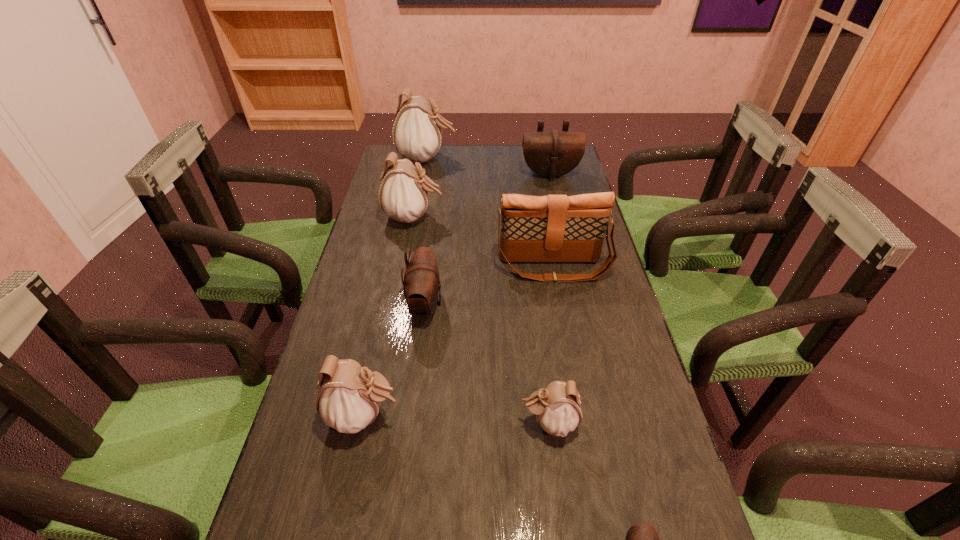
Where is `the farthest white pouch`? This screenshot has height=540, width=960. the farthest white pouch is located at coordinates (417, 131).

Locate an element on the screen. Image resolution: width=960 pixels, height=540 pixels. the tallest pouch is located at coordinates (417, 131).

This screenshot has width=960, height=540. What are the coordinates of `shoulder bag` in the screenshot? It's located at coord(554,228).

You are a GUI agent. You are given a task and a screenshot of the screen. Output one action in this format:
    pyautogui.click(x=<x>, y=<y>)
    Task: Click on the sixth nearest object
    The image size is (960, 540).
    Given the screenshot: What is the action you would take?
    pyautogui.click(x=403, y=196)

Identify the location of the third farthest pouch. (403, 196).

Locate an element on the screen. Image resolution: width=960 pixels, height=540 pixels. the biggest brown pouch is located at coordinates 551,154.

This screenshot has width=960, height=540. I want to click on the third biggest white pouch, so click(x=349, y=396).

Locate an element on the screen. This screenshot has height=540, width=960. the second smallest brown pouch is located at coordinates (421, 285).

Image resolution: width=960 pixels, height=540 pixels. I want to click on the second nearest brown pouch, so click(x=421, y=285).

The width and height of the screenshot is (960, 540). Identify the location of the rightmost white pouch. (558, 407).